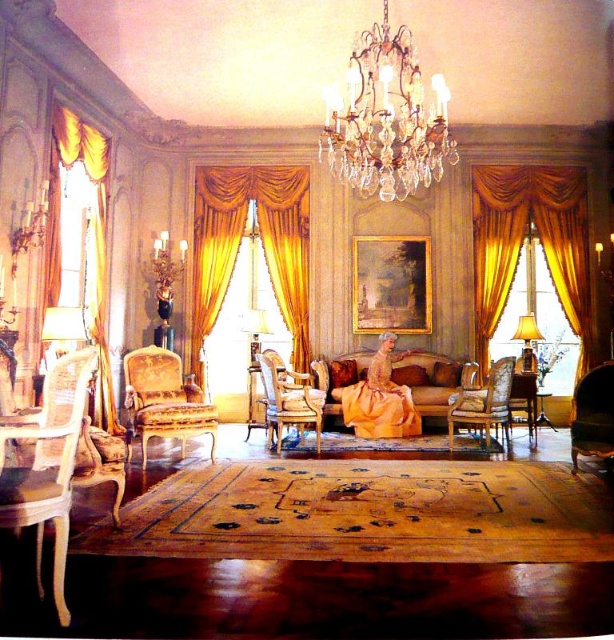
You are a decorator planning to hang a large painting between the gold velvet curtains at right and the gold velvet curtain at left. Which curtain should the painting be closer to if you want it centered between them?

The painting should be closer to the gold velvet curtains at right because it is smaller than the gold velvet curtain at left, so centering it would require positioning it nearer to the smaller curtain to balance the distance.

You are planning to place a large potted plant between the velvet dark green armchair at lower right and the wooden armchair at center. Given that the space between them is 1.2 meters wide, can the plant, which is 1 meter wide, fit comfortably without overcrowding the area?

The space between the velvet dark green armchair at lower right and the wooden armchair at center is 1.2 meters wide. Since the plant is 1 meter wide, it will fit comfortably with some space remaining, so yes, it can be placed there.

You are standing in the elegantly furnished room and notice two gold velvet curtains. The one on the left is the gold velvet curtain at left, and the one on the right is the gold velvet curtains at right. Which curtain is positioned to the right of the other?

The gold velvet curtains at right is positioned on the right side of gold velvet curtain at left.